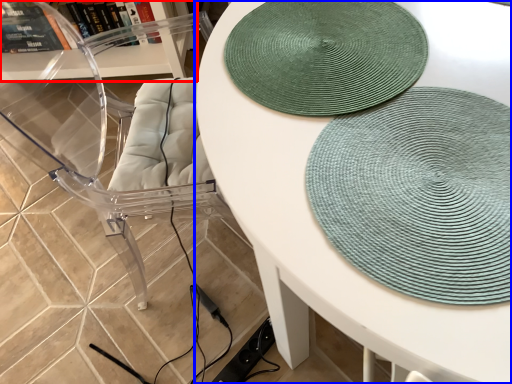
Question: Which of the following is the closest to the observer, shelf (highlighted by a red box) or table (highlighted by a blue box)?

Choices:
 (A) shelf
 (B) table

Answer: (B)